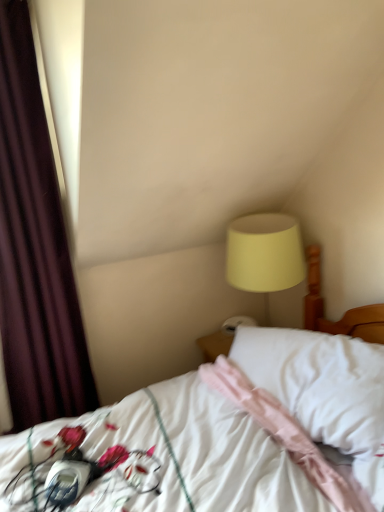
Question: Considering the positions of pink fabric pillow at center and white satin bed at center in the image, is pink fabric pillow at center bigger or smaller than white satin bed at center?

Choices:
 (A) big
 (B) small

Answer: (B)

Question: Is pink fabric pillow at center in front of or behind white satin bed at center in the image?

Choices:
 (A) behind
 (B) front

Answer: (A)

Question: Based on their relative distances, which object is farther from the pink fabric pillow at center?

Choices:
 (A) white satin bed at center
 (B) dark purple velvet curtain at left
 (C) matte yellow lampshade at upper right

Answer: (B)

Question: Estimate the real-world distances between objects in this image. Which object is closer to the dark purple velvet curtain at left?

Choices:
 (A) pink fabric pillow at center
 (B) matte yellow lampshade at upper right
 (C) white satin bed at center

Answer: (C)